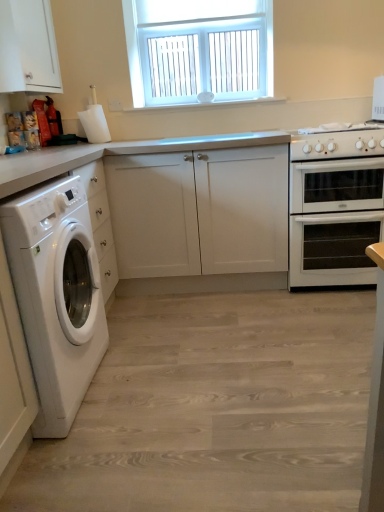
Question: Would you say white plastic window at upper center is to the left or to the right of white glossy washing machine at left in the picture?

Choices:
 (A) right
 (B) left

Answer: (A)

Question: Considering the positions of point (135, 25) and point (31, 192), is point (135, 25) closer or farther from the camera than point (31, 192)?

Choices:
 (A) farther
 (B) closer

Answer: (A)

Question: Based on their relative distances, which object is farther from the white glossy oven at right?

Choices:
 (A) white matte cabinet at left, which appears as the second cabinetry when viewed from the top
 (B) white matte cabinet at upper left, acting as the second cabinetry starting from the bottom
 (C) white plastic window at upper center
 (D) white glossy gas stove at right
 (E) white glossy washing machine at left

Answer: (B)

Question: Considering the real-world distances, which object is closest to the white glossy gas stove at right?

Choices:
 (A) white matte cabinet at upper left, positioned as the 2th cabinetry in right-to-left order
 (B) white plastic window at upper center
 (C) white glossy oven at right
 (D) white matte cabinet at left, which appears as the 1th cabinetry when viewed from the right
 (E) white glossy washing machine at left

Answer: (C)